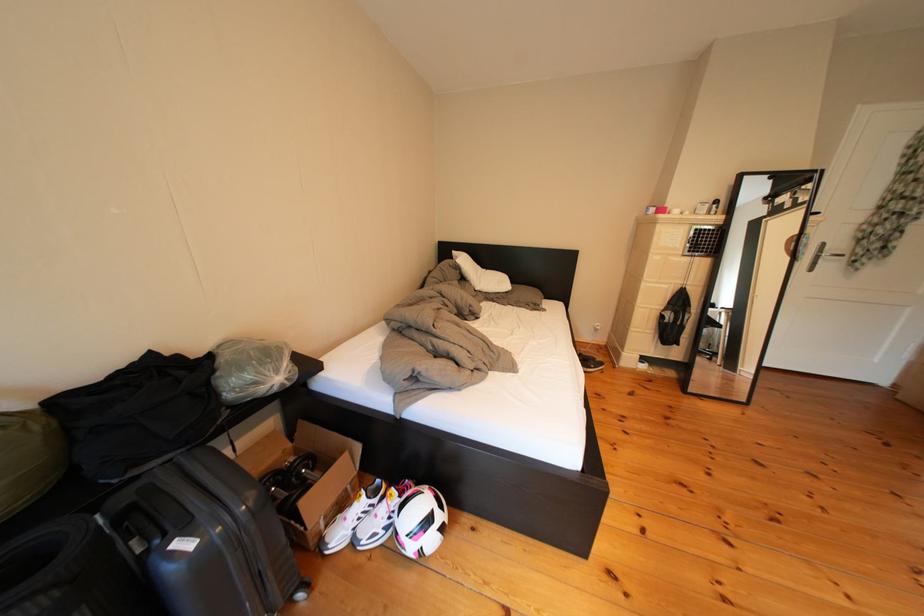
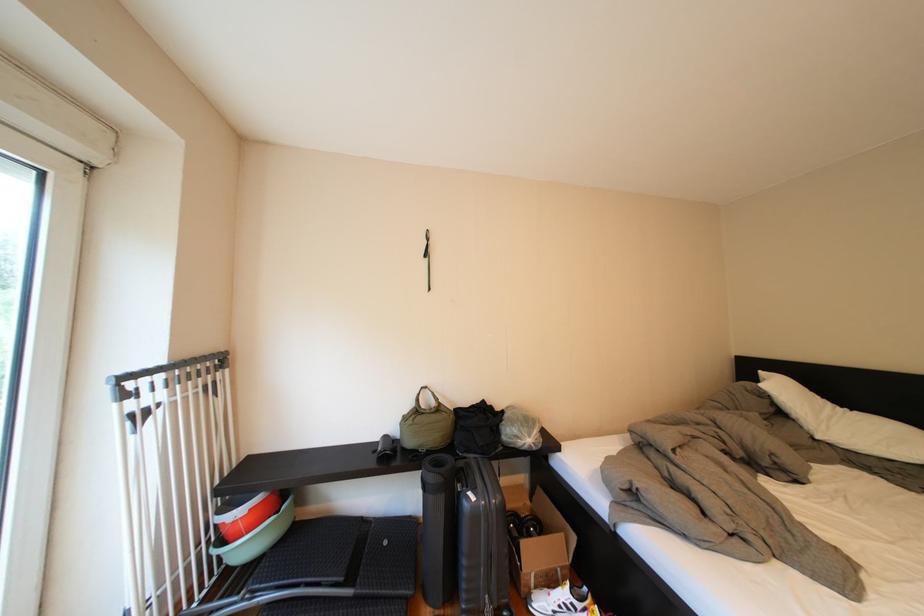
Locate, in the second image, the point that corresponds to the point at 329,507 in the first image.

(544, 557)